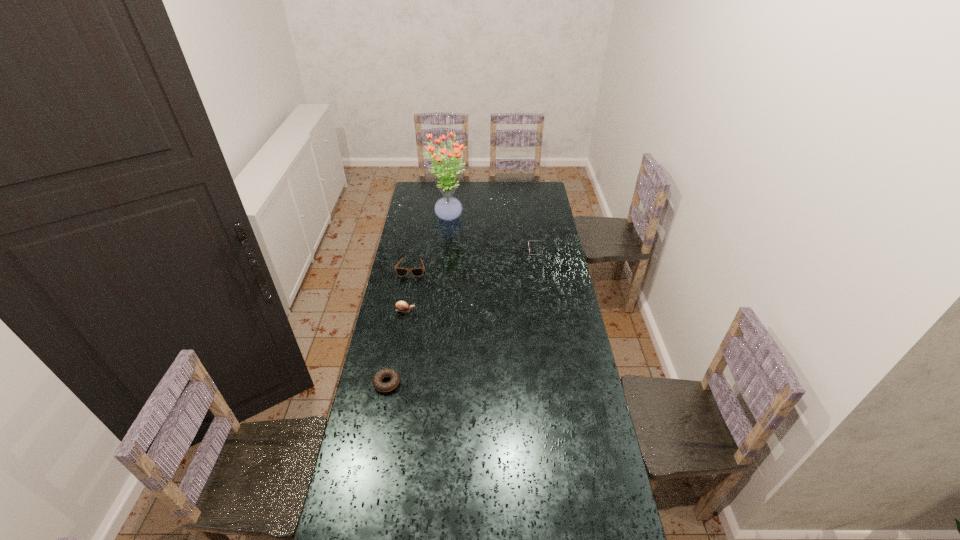
Identify the location of vacant region located 0.270m on the front-facing side of the escargot. This screenshot has height=540, width=960. (474, 310).

Identify the location of vacant space located on the frames of the left sunglasses. The width and height of the screenshot is (960, 540). point(403,314).

Where is `blank space located on the front-facing side of the fourth nearest object`? Image resolution: width=960 pixels, height=540 pixels. blank space located on the front-facing side of the fourth nearest object is located at coordinates (502, 252).

Where is `blank space located on the front-facing side of the fourth nearest object`? The height and width of the screenshot is (540, 960). blank space located on the front-facing side of the fourth nearest object is located at coordinates (473, 252).

Find the location of a particular element. The height and width of the screenshot is (540, 960). blank area located 0.210m on the front-facing side of the fourth nearest object is located at coordinates (489, 252).

This screenshot has height=540, width=960. In order to click on free space located 0.270m on the front of the doughnut in this screenshot , I will do coord(372,463).

The width and height of the screenshot is (960, 540). I want to click on flower arrangement situated at the left edge, so click(448, 208).

What are the coordinates of `escargot present at the left edge` in the screenshot? It's located at (402, 306).

In order to click on sunglasses positioned at the left edge in this screenshot , I will do `click(402, 272)`.

Image resolution: width=960 pixels, height=540 pixels. Find the location of `doughnut present at the left edge`. doughnut present at the left edge is located at coordinates (386, 372).